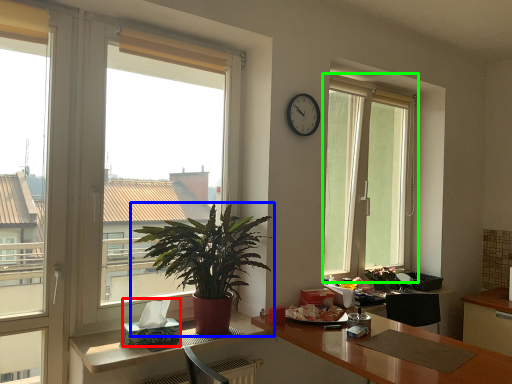
Question: Which object is positioned closest to tissue paper (highlighted by a red box)? Select from houseplant (highlighted by a blue box) and window (highlighted by a green box).

Choices:
 (A) houseplant
 (B) window

Answer: (A)